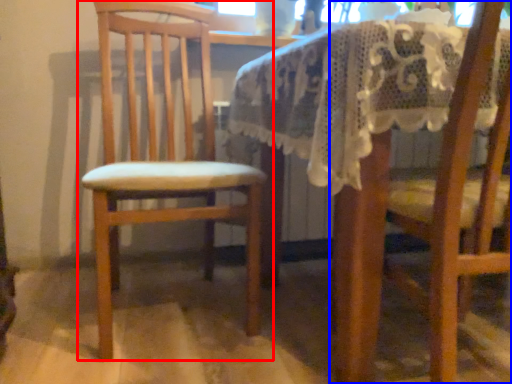
Question: Which object is closer to the camera taking this photo, chair (highlighted by a red box) or chair (highlighted by a blue box)?

Choices:
 (A) chair
 (B) chair

Answer: (B)